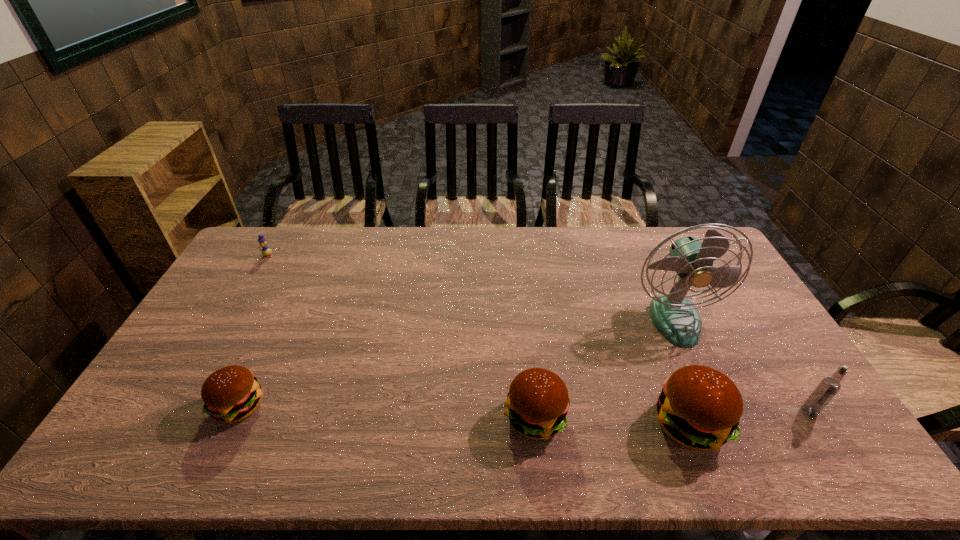
At what (x,y) coordinates should I click in order to perform the action: click on free spot located 0.140m on the back of the fifth tallest object. Please return your answer as a coordinate pair (x, y). This screenshot has height=540, width=960. Looking at the image, I should click on point(268,344).

Where is `blank space located on the back of the second hamburger from left to right`? blank space located on the back of the second hamburger from left to right is located at coordinates (522, 296).

Locate an element on the screen. The width and height of the screenshot is (960, 540). vacant space located on the left of the rightmost hamburger is located at coordinates (587, 425).

Image resolution: width=960 pixels, height=540 pixels. Find the location of `vacant space located on the face of the leftmost object, where the monocle is placed`. vacant space located on the face of the leftmost object, where the monocle is placed is located at coordinates (249, 288).

Find the location of a particular element. free space located in front of the fan, directing airflow is located at coordinates (706, 388).

The height and width of the screenshot is (540, 960). Find the location of `object that is at the far edge`. object that is at the far edge is located at coordinates (265, 251).

In order to click on vodka present at the near edge in this screenshot , I will do `click(829, 386)`.

Where is `object that is at the left edge`? object that is at the left edge is located at coordinates click(265, 251).

Where is `vodka present at the right edge`? The width and height of the screenshot is (960, 540). vodka present at the right edge is located at coordinates (829, 386).

I want to click on fan situated at the right edge, so click(x=676, y=318).